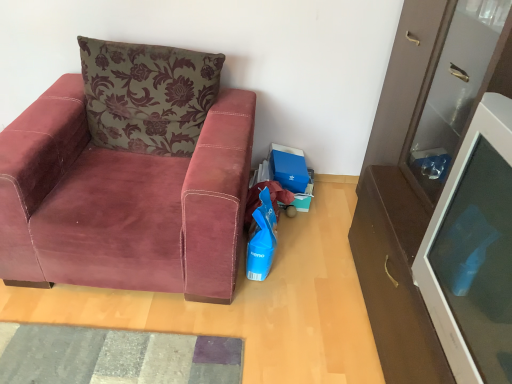
Where is `velvet maroon armchair at left`? This screenshot has height=384, width=512. velvet maroon armchair at left is located at coordinates (129, 175).

I want to click on velvet floral pillow at upper left, so click(x=147, y=95).

What is the approximate width of velvet floral pillow at upper left?

12.54 inches.

Image resolution: width=512 pixels, height=384 pixels. I want to click on textured gray mat at lower left, so click(114, 356).

You are a GUI agent. You are given a task and a screenshot of the screen. Output one action in this format:
    pyautogui.click(x=<x>, y=<y>)
    Task: Click on the white glossy cabinet at right
    This screenshot has width=512, height=384.
    Given the screenshot: What is the action you would take?
    pyautogui.click(x=414, y=182)

Is velvet floral pillow at upper left looking in the opposite direction of white glossy cabinet at right?

velvet floral pillow at upper left is not turned away from white glossy cabinet at right.

The image size is (512, 384). I want to click on pillow behind the white glossy cabinet at right, so click(x=147, y=95).

From the image's perspective, between velvet floral pillow at upper left and white glossy cabinet at right, which one is located above?

velvet floral pillow at upper left, from the image's perspective.

Which is more to the left, white glossy cabinet at right or textured gray mat at lower left?

textured gray mat at lower left is more to the left.

Locate an element on the screen. The image size is (512, 384). cabinetry that appears in front of the textured gray mat at lower left is located at coordinates (414, 182).

Is white glossy cabinet at right oriented away from textured gray mat at lower left?

No, white glossy cabinet at right is not facing away from textured gray mat at lower left.

From a real-world perspective, between white glossy cabinet at right and textured gray mat at lower left, who is vertically higher?

white glossy cabinet at right is physically above.

Between white glossy cabinet at right and velvet floral pillow at upper left, which one appears on the left side from the viewer's perspective?

Positioned to the left is velvet floral pillow at upper left.

Would you say white glossy cabinet at right is outside velvet floral pillow at upper left?

Absolutely, white glossy cabinet at right is external to velvet floral pillow at upper left.

From the image's perspective, between white glossy cabinet at right and velvet floral pillow at upper left, which one is located above?

velvet floral pillow at upper left is shown above in the image.

From a real-world perspective, between white glossy cabinet at right and velvet floral pillow at upper left, who is vertically higher?

In real-world perspective, white glossy cabinet at right is above.

Based on the photo, is velvet maroon armchair at left completely or partially outside of velvet floral pillow at upper left?

Yes, velvet maroon armchair at left is not within velvet floral pillow at upper left.

Find the location of a particular element. chair in front of the velvet floral pillow at upper left is located at coordinates coord(129,175).

Would you consider velvet maroon armchair at left to be distant from velvet floral pillow at upper left?

No.

Is velvet floral pillow at upper left shorter than textured gray mat at lower left?

In fact, velvet floral pillow at upper left may be taller than textured gray mat at lower left.

From a real-world perspective, who is located lower, velvet floral pillow at upper left or textured gray mat at lower left?

textured gray mat at lower left.

Is the surface of velvet floral pillow at upper left in direct contact with textured gray mat at lower left?

velvet floral pillow at upper left and textured gray mat at lower left are not in contact.

Is textured gray mat at lower left located within velvet floral pillow at upper left?

No, textured gray mat at lower left is not a part of velvet floral pillow at upper left.

Is textured gray mat at lower left far away from velvet floral pillow at upper left?

textured gray mat at lower left is actually quite close to velvet floral pillow at upper left.

Which object is closer to the camera, textured gray mat at lower left or velvet floral pillow at upper left?

textured gray mat at lower left is closer to the camera.

Is textured gray mat at lower left aimed at velvet floral pillow at upper left?

No.

Consider the image. From a real-world perspective, is white glossy cabinet at right positioned over velvet maroon armchair at left based on gravity?

Correct, in the physical world, white glossy cabinet at right is higher than velvet maroon armchair at left.

Can you tell me how much white glossy cabinet at right and velvet maroon armchair at left differ in facing direction?

86.9 degrees separate the facing orientations of white glossy cabinet at right and velvet maroon armchair at left.

Is white glossy cabinet at right positioned with its back to velvet maroon armchair at left?

white glossy cabinet at right does not have its back to velvet maroon armchair at left.

Based on the photo, in the image, is white glossy cabinet at right positioned in front of or behind velvet maroon armchair at left?

white glossy cabinet at right is in front of velvet maroon armchair at left.

Where is `cabinetry below the velvet floral pillow at upper left (from the image's perspective)`? The image size is (512, 384). cabinetry below the velvet floral pillow at upper left (from the image's perspective) is located at coordinates (414, 182).

This screenshot has width=512, height=384. What are the coordinates of `mat below the white glossy cabinet at right (from a real-world perspective)` in the screenshot? It's located at tap(114, 356).

Estimate the real-world distances between objects in this image. Which object is closer to velvet maroon armchair at left, white glossy cabinet at right or textured gray mat at lower left?

textured gray mat at lower left is closer to velvet maroon armchair at left.

Looking at this image, estimate the real-world distances between objects in this image. Which object is further from white glossy cabinet at right, velvet floral pillow at upper left or textured gray mat at lower left?

velvet floral pillow at upper left is further to white glossy cabinet at right.

Consider the image. Looking at the image, which one is located further to velvet floral pillow at upper left, textured gray mat at lower left or velvet maroon armchair at left?

textured gray mat at lower left is further to velvet floral pillow at upper left.

Which object lies nearer to the anchor point velvet maroon armchair at left, white glossy cabinet at right or velvet floral pillow at upper left?

velvet floral pillow at upper left.

Estimate the real-world distances between objects in this image. Which object is closer to velvet maroon armchair at left, velvet floral pillow at upper left or textured gray mat at lower left?

The object closer to velvet maroon armchair at left is velvet floral pillow at upper left.

Which object lies nearer to the anchor point white glossy cabinet at right, velvet maroon armchair at left or velvet floral pillow at upper left?

velvet maroon armchair at left lies closer to white glossy cabinet at right than the other object.

Looking at this image, which object lies further to the anchor point white glossy cabinet at right, velvet maroon armchair at left or textured gray mat at lower left?

textured gray mat at lower left.

From the image, which object appears to be nearer to velvet maroon armchair at left, textured gray mat at lower left or white glossy cabinet at right?

textured gray mat at lower left lies closer to velvet maroon armchair at left than the other object.

The image size is (512, 384). I want to click on pillow located between textured gray mat at lower left and white glossy cabinet at right in the left-right direction, so click(x=147, y=95).

This screenshot has width=512, height=384. Find the location of `mat between velvet maroon armchair at left and white glossy cabinet at right in the horizontal direction`. mat between velvet maroon armchair at left and white glossy cabinet at right in the horizontal direction is located at coordinates (114, 356).

Locate an element on the screen. chair that lies between velvet floral pillow at upper left and textured gray mat at lower left from top to bottom is located at coordinates (129, 175).

You are a GUI agent. You are given a task and a screenshot of the screen. Output one action in this format:
    pyautogui.click(x=<x>, y=<y>)
    Task: Click on the pillow between velvet maroon armchair at left and white glossy cabinet at right in the horizontal direction
    
    Given the screenshot: What is the action you would take?
    tap(147, 95)